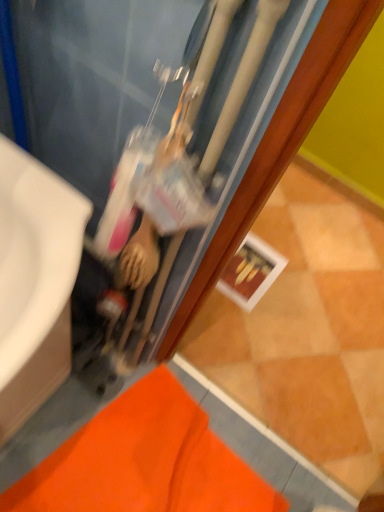
What is the approximate height of white glossy sink at left?

white glossy sink at left is 77.15 centimeters tall.

Describe the element at coordinates (144, 461) in the screenshot. I see `orange fabric bath mat at lower left` at that location.

What is the approximate height of matte black water heater at center?

matte black water heater at center is 1.08 meters in height.

You are a GUI agent. You are given a task and a screenshot of the screen. Output one action in this format:
    pyautogui.click(x=<x>, y=<y>)
    Task: Click on the white glossy sink at left
    The height and width of the screenshot is (512, 384).
    Given the screenshot: What is the action you would take?
    pyautogui.click(x=34, y=253)

Is white glossy sink at left turned away from matte black water heater at center?

That's not correct — white glossy sink at left is not looking away from matte black water heater at center.

From the image's perspective, is white glossy sink at left beneath matte black water heater at center?

Yes, from the image's perspective, white glossy sink at left is beneath matte black water heater at center.

Which of these two, white glossy sink at left or matte black water heater at center, is wider?

white glossy sink at left is wider.

Is orange fabric bath mat at lower left to the left or to the right of white glossy sink at left in the image?

From the image, it's evident that orange fabric bath mat at lower left is to the right of white glossy sink at left.

Can you confirm if orange fabric bath mat at lower left is wider than white glossy sink at left?

Indeed, orange fabric bath mat at lower left has a greater width compared to white glossy sink at left.

Is orange fabric bath mat at lower left positioned far away from white glossy sink at left?

No, orange fabric bath mat at lower left is not far away from white glossy sink at left.

How different are the orientations of orange fabric bath mat at lower left and white glossy sink at left in degrees?

81.2 degrees.

The image size is (384, 512). In order to click on bath mat to the right of matte black water heater at center in this screenshot , I will do `click(144, 461)`.

From the picture: Looking at the image, does matte black water heater at center seem bigger or smaller compared to orange fabric bath mat at lower left?

Clearly, matte black water heater at center is larger in size than orange fabric bath mat at lower left.

How much distance is there between matte black water heater at center and orange fabric bath mat at lower left?

matte black water heater at center is 20.48 inches from orange fabric bath mat at lower left.

Is matte black water heater at center surrounded by orange fabric bath mat at lower left?

No, matte black water heater at center is not a part of orange fabric bath mat at lower left.

Can you tell me how much orange fabric bath mat at lower left and matte black water heater at center differ in facing direction?

The facing directions of orange fabric bath mat at lower left and matte black water heater at center are 169 degrees apart.

Considering the relative sizes of orange fabric bath mat at lower left and matte black water heater at center in the image provided, is orange fabric bath mat at lower left wider than matte black water heater at center?

Indeed, orange fabric bath mat at lower left has a greater width compared to matte black water heater at center.

Is point (64, 257) less distant than point (221, 468)?

Yes, it is.

Does white glossy sink at left appear on the left side of orange fabric bath mat at lower left?

Yes.

Is white glossy sink at left turned away from orange fabric bath mat at lower left?

No, white glossy sink at left is not facing away from orange fabric bath mat at lower left.

Are matte black water heater at center and white glossy sink at left making contact?

No.

Identify the location of sink lying below the matte black water heater at center (from the image's perspective). The image size is (384, 512). (34, 253).

Is matte black water heater at center to the left or to the right of white glossy sink at left in the image?

Clearly, matte black water heater at center is on the right of white glossy sink at left in the image.

Locate an element on the screen. The width and height of the screenshot is (384, 512). sink behind the matte black water heater at center is located at coordinates (34, 253).

The width and height of the screenshot is (384, 512). Find the location of `sink that appears on the left of orange fabric bath mat at lower left`. sink that appears on the left of orange fabric bath mat at lower left is located at coordinates (34, 253).

Looking at the image, which one is located further to orange fabric bath mat at lower left, matte black water heater at center or white glossy sink at left?

white glossy sink at left.

Looking at the image, which one is located further to white glossy sink at left, matte black water heater at center or orange fabric bath mat at lower left?

orange fabric bath mat at lower left is further to white glossy sink at left.

Considering their positions, is orange fabric bath mat at lower left positioned closer to matte black water heater at center than white glossy sink at left?

Based on the image, white glossy sink at left appears to be nearer to matte black water heater at center.

When comparing their distances from matte black water heater at center, does white glossy sink at left or orange fabric bath mat at lower left seem closer?

white glossy sink at left is positioned closer to the anchor matte black water heater at center.

Which object lies further to the anchor point white glossy sink at left, orange fabric bath mat at lower left or matte black water heater at center?

Based on the image, orange fabric bath mat at lower left appears to be further to white glossy sink at left.

In the scene shown: From the image, which object appears to be farther from orange fabric bath mat at lower left, white glossy sink at left or matte black water heater at center?

white glossy sink at left is further to orange fabric bath mat at lower left.

Locate an element on the screen. The height and width of the screenshot is (512, 384). sink between matte black water heater at center and orange fabric bath mat at lower left in the vertical direction is located at coordinates (34, 253).